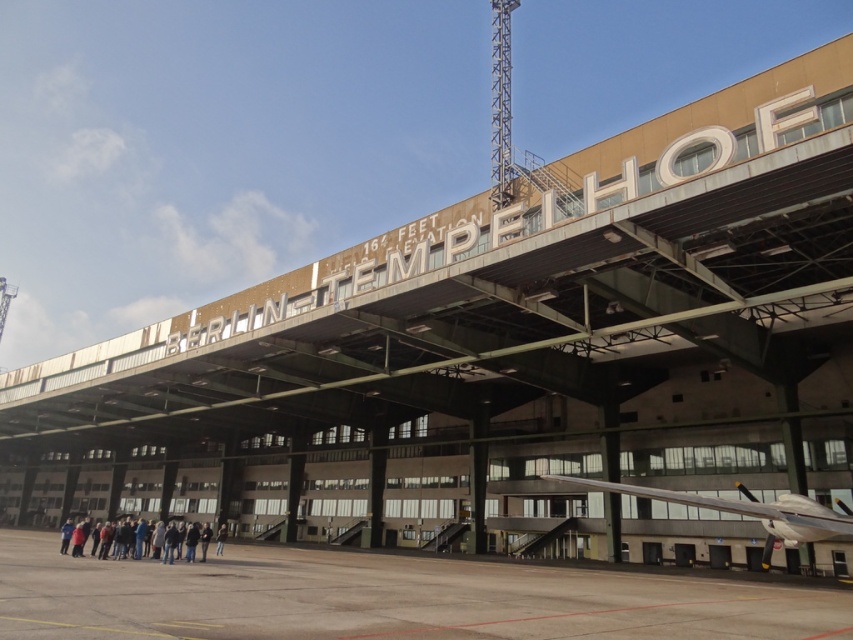
Question: Is white glossy airplane at lower right in front of dark blue jeans at lower center?

Choices:
 (A) no
 (B) yes

Answer: (B)

Question: Does gray concrete tarmac at lower center have a smaller size compared to dark blue jeans at lower center?

Choices:
 (A) no
 (B) yes

Answer: (A)

Question: Among these objects, which one is farthest from the camera?

Choices:
 (A) dark blue jeans at lower center
 (B) gray concrete tarmac at lower center

Answer: (A)

Question: Is white glossy airplane at lower right wider than dark blue jeans at lower center?

Choices:
 (A) no
 (B) yes

Answer: (B)

Question: Estimate the real-world distances between objects in this image. Which object is closer to the gray concrete tarmac at lower center?

Choices:
 (A) dark blue jeans at lower center
 (B) white glossy airplane at lower right

Answer: (B)

Question: Which object appears farthest from the camera in this image?

Choices:
 (A) dark blue jeans at lower center
 (B) gray concrete tarmac at lower center

Answer: (A)